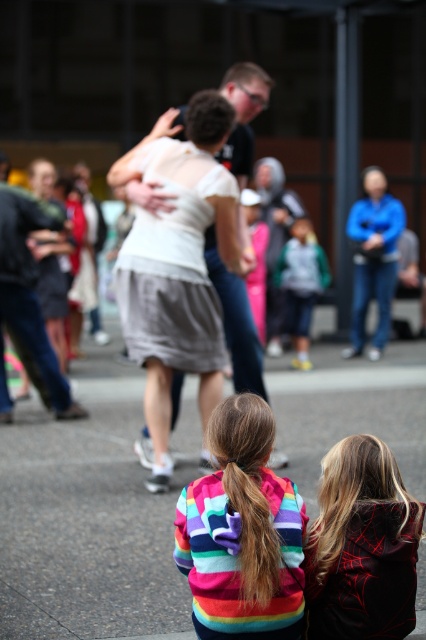
Question: Which of the following is the farthest from the observer?

Choices:
 (A) pos(233,625)
 (B) pos(356,592)
 (C) pos(293,305)
 (D) pos(2,179)

Answer: (C)

Question: Which point is farther from the camera taking this photo?

Choices:
 (A) click(43, 513)
 (B) click(25, 200)

Answer: (B)

Question: From the image, what is the correct spatial relationship of matte black jacket at left in relation to gray-green jacket at center?

Choices:
 (A) left
 (B) right

Answer: (A)

Question: Observing the image, what is the correct spatial positioning of rainbow striped sweater at lower center in reference to dark red hoodie at lower right?

Choices:
 (A) right
 (B) left

Answer: (B)

Question: Is matte black jacket at left smaller than gray-green jacket at center?

Choices:
 (A) no
 (B) yes

Answer: (B)

Question: Among these points, which one is nearest to the camera?

Choices:
 (A) (140, 582)
 (B) (201, 384)
 (C) (253, 394)

Answer: (C)